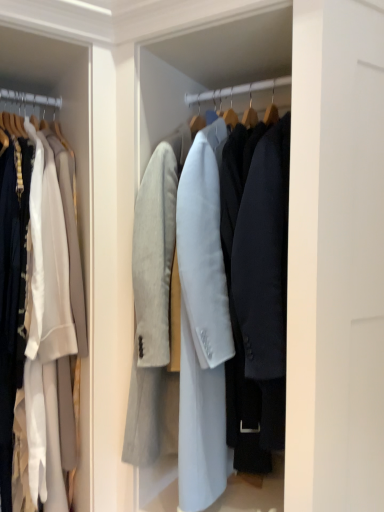
Question: Is light gray wool coat at center, the second coat when ordered from left to right, to the left or to the right of white wool coat at left, placed as the second coat when sorted from right to left, in the image?

Choices:
 (A) left
 (B) right

Answer: (B)

Question: In terms of height, does light gray wool coat at center, the second coat when ordered from left to right, look taller or shorter compared to white wool coat at left, placed as the second coat when sorted from right to left?

Choices:
 (A) short
 (B) tall

Answer: (A)

Question: From the image's perspective, is light gray wool coat at center, the 1th coat positioned from the right, positioned above or below white wool coat at left, the 1th coat viewed from the left?

Choices:
 (A) below
 (B) above

Answer: (B)

Question: Does point (8, 297) appear closer or farther from the camera than point (216, 220)?

Choices:
 (A) farther
 (B) closer

Answer: (A)

Question: Which is correct: white wool coat at left, placed as the second coat when sorted from right to left, is inside light gray wool coat at center, the 1th coat positioned from the right, or outside of it?

Choices:
 (A) outside
 (B) inside

Answer: (A)

Question: Based on their positions, is white wool coat at left, the 1th coat viewed from the left, located to the left or right of light gray wool coat at center, the second coat when ordered from left to right?

Choices:
 (A) right
 (B) left

Answer: (B)

Question: In terms of height, does white wool coat at left, the 1th coat viewed from the left, look taller or shorter compared to light gray wool coat at center, the 1th coat positioned from the right?

Choices:
 (A) tall
 (B) short

Answer: (A)